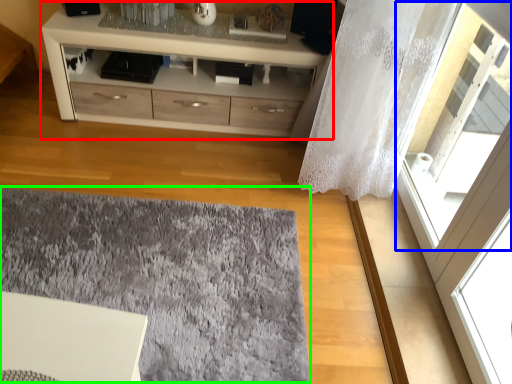
Question: Which object is the closest to the chest of drawers (highlighted by a red box)? Choose among these: window (highlighted by a blue box) or mat (highlighted by a green box).

Choices:
 (A) window
 (B) mat

Answer: (A)